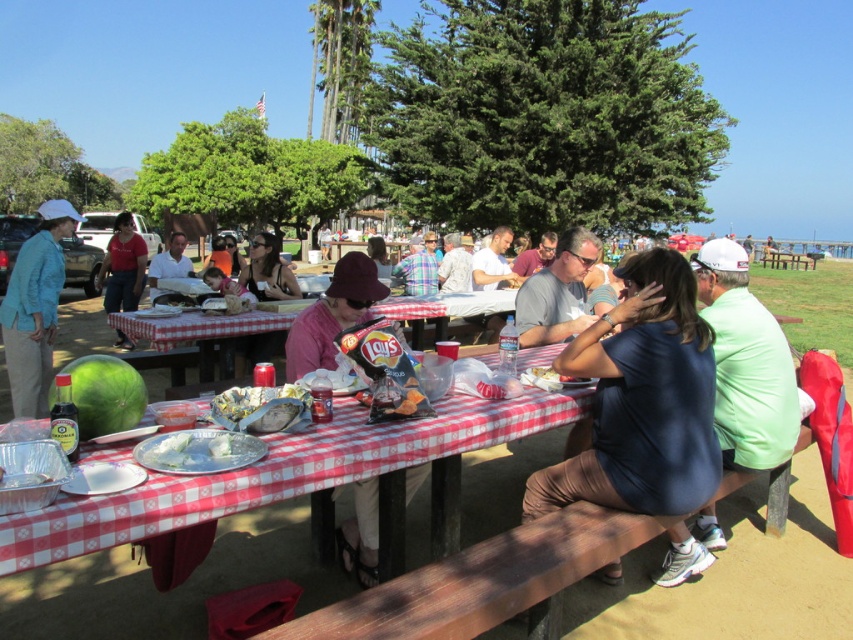
Question: Is the position of pink fabric hat at center less distant than that of matte black shirt at center?

Choices:
 (A) yes
 (B) no

Answer: (A)

Question: Estimate the real-world distances between objects in this image. Which object is closer to the matte black shirt at center?

Choices:
 (A) gray matte shirt at center
 (B) pink fabric hat at center
 (C) blue fabric shirt at center

Answer: (A)

Question: Is pink fabric hat at center below matte black shirt at center?

Choices:
 (A) no
 (B) yes

Answer: (B)

Question: Does matte blue jacket at left have a smaller size compared to gray matte shirt at center?

Choices:
 (A) no
 (B) yes

Answer: (B)

Question: Which point is farther to the camera?

Choices:
 (A) (15, 349)
 (B) (134, 234)

Answer: (B)

Question: Which point is closer to the camera?

Choices:
 (A) gray matte shirt at center
 (B) red checkered tablecloth at center
 (C) matte blue jacket at left

Answer: (B)